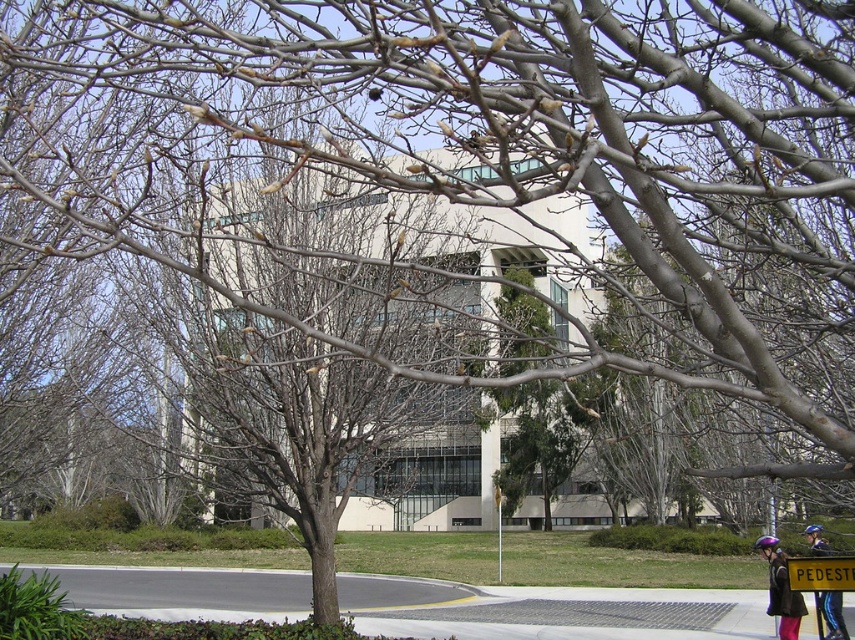
This screenshot has height=640, width=855. Describe the element at coordinates (780, 589) in the screenshot. I see `purple helmet at lower right` at that location.

At what (x,y) coordinates should I click in order to perform the action: click on purple helmet at lower right. Please return your answer as a coordinate pair (x, y). Looking at the image, I should click on (780, 589).

Locate an element on the screen. This screenshot has width=855, height=640. purple helmet at lower right is located at coordinates (780, 589).

Looking at this image, between yellow plastic sign at center and blue helmet at lower right, which one appears on the left side from the viewer's perspective?

From the viewer's perspective, yellow plastic sign at center appears more on the left side.

This screenshot has width=855, height=640. Find the location of `yellow plastic sign at center`. yellow plastic sign at center is located at coordinates click(x=821, y=573).

Where is `yellow plastic sign at center`? yellow plastic sign at center is located at coordinates (821, 573).

Is purple helmet at lower right positioned before blue helmet at lower right?

That is True.

Is purple helmet at lower right bigger than blue helmet at lower right?

Indeed, purple helmet at lower right has a larger size compared to blue helmet at lower right.

Is point (771, 563) positioned behind point (811, 528)?

No, (771, 563) is in front of (811, 528).

Locate an element on the screen. This screenshot has height=640, width=855. purple helmet at lower right is located at coordinates (780, 589).